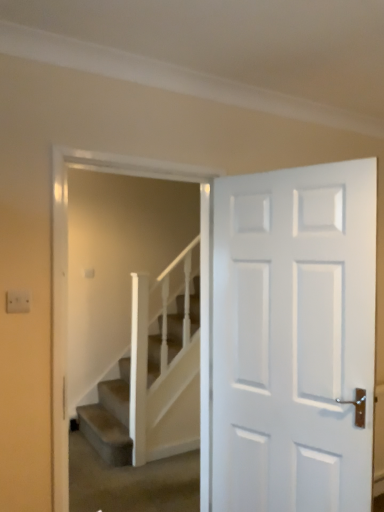
The image size is (384, 512). What do you see at coordinates (110, 419) in the screenshot? I see `white textured stairs at center` at bounding box center [110, 419].

Where is `white textured stairs at center`? The width and height of the screenshot is (384, 512). white textured stairs at center is located at coordinates (110, 419).

Describe the element at coordinates (294, 338) in the screenshot. I see `white matte door at right` at that location.

Locate an element on the screen. white matte door at right is located at coordinates (294, 338).

Consider the image. What is the approximate width of white matte door at right?

It is 5.26 inches.

In order to click on white textured stairs at center in this screenshot , I will do `click(110, 419)`.

Visually, is white matte door at right positioned to the left or to the right of white textured stairs at center?

Based on their positions, white matte door at right is located to the right of white textured stairs at center.

From the picture: Considering the positions of objects white matte door at right and white textured stairs at center in the image provided, who is in front, white matte door at right or white textured stairs at center?

white matte door at right is in front.

Based on the photo, which is closer to the camera, (295, 259) or (99, 438)?

Point (295, 259) is positioned closer to the camera compared to point (99, 438).

From the image's perspective, which one is positioned higher, white matte door at right or white textured stairs at center?

white matte door at right is shown above in the image.

From a real-world perspective, between white matte door at right and white textured stairs at center, who is vertically higher?

white matte door at right is physically above.

Considering the relative sizes of white matte door at right and white textured stairs at center in the image provided, is white matte door at right wider than white textured stairs at center?

Yes, white matte door at right is wider than white textured stairs at center.

Considering the sizes of objects white matte door at right and white textured stairs at center in the image provided, who is shorter, white matte door at right or white textured stairs at center?

With less height is white textured stairs at center.

Based on their sizes in the image, would you say white matte door at right is bigger or smaller than white textured stairs at center?

white matte door at right is bigger than white textured stairs at center.

Is white matte door at right inside or outside of white textured stairs at center?

The correct answer is: outside.

Is white matte door at right placed right next to white textured stairs at center?

No, white matte door at right is not in contact with white textured stairs at center.

Is white matte door at right positioned with its back to white textured stairs at center?

white matte door at right does not have its back to white textured stairs at center.

What's the angular difference between white matte door at right and white textured stairs at center's facing directions?

There is a 70.4-degree angle between the facing directions of white matte door at right and white textured stairs at center.

Where is `door above the white textured stairs at center (from the image's perspective)`? door above the white textured stairs at center (from the image's perspective) is located at coordinates (294, 338).

Is white textured stairs at center at the left side of white matte door at right?

Correct, you'll find white textured stairs at center to the left of white matte door at right.

Does white textured stairs at center lie in front of white matte door at right?

No, white textured stairs at center is further to the viewer.

Does point (192, 297) come closer to viewer compared to point (312, 172)?

That is False.

From the image's perspective, is white textured stairs at center below white matte door at right?

Yes, from the image's perspective, white textured stairs at center is below white matte door at right.

From a real-world perspective, is white textured stairs at center positioned over white matte door at right based on gravity?

Actually, white textured stairs at center is physically below white matte door at right in the real world.

Does white textured stairs at center have a lesser width compared to white matte door at right?

Yes, white textured stairs at center is thinner than white matte door at right.

Between white textured stairs at center and white matte door at right, which one has more height?

white matte door at right is taller.

Considering the sizes of white textured stairs at center and white matte door at right in the image, is white textured stairs at center bigger or smaller than white matte door at right?

Considering their sizes, white textured stairs at center takes up less space than white matte door at right.

Is white textured stairs at center situated inside white matte door at right or outside?

white textured stairs at center is spatially situated outside white matte door at right.

Is there a large distance between white textured stairs at center and white matte door at right?

That's right, there is a large distance between white textured stairs at center and white matte door at right.

Consider the image. Does white textured stairs at center turn towards white matte door at right?

Yes, white textured stairs at center is facing white matte door at right.

The width and height of the screenshot is (384, 512). I want to click on door on the right of white textured stairs at center, so [x=294, y=338].

At what (x,y) coordinates should I click in order to perform the action: click on stairs on the left of white matte door at right. Please return your answer as a coordinate pair (x, y). Image resolution: width=384 pixels, height=512 pixels. Looking at the image, I should click on (110, 419).

Where is `door that appears above the white textured stairs at center (from the image's perspective)`? The height and width of the screenshot is (512, 384). door that appears above the white textured stairs at center (from the image's perspective) is located at coordinates (294, 338).